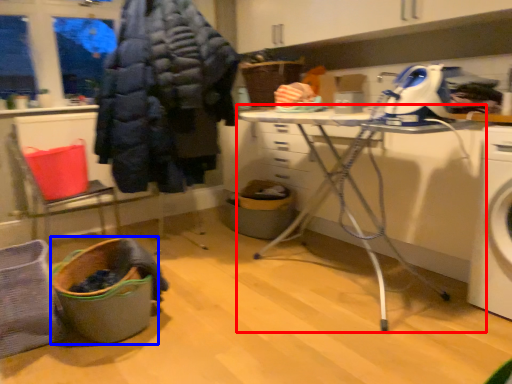
Question: Which object appears farthest to the camera in this image, table (highlighted by a red box) or laundry basket (highlighted by a blue box)?

Choices:
 (A) table
 (B) laundry basket

Answer: (A)